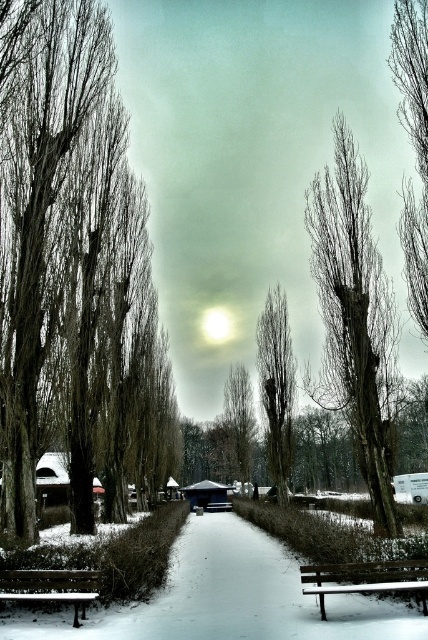
You are planning to place a new bench in the winter scene. The existing wooden bench at lower left is next to the bare wood tree at center. Considering their widths, which object would require more space if you want to move them both horizontally?

The bare wood tree at center has a larger width than the wooden bench at lower left, so moving them both horizontally would require more space for the bare wood tree at center.

You are standing at the center of the snow path and want to take a photo of the bare wood tree at center. Where should you position yourself relative to the tree to ensure it is centered in your camera view?

The bare wood tree at center is located at point coordinates (353,317), so you should position yourself directly in front of it along the snow path to center it in your camera view.